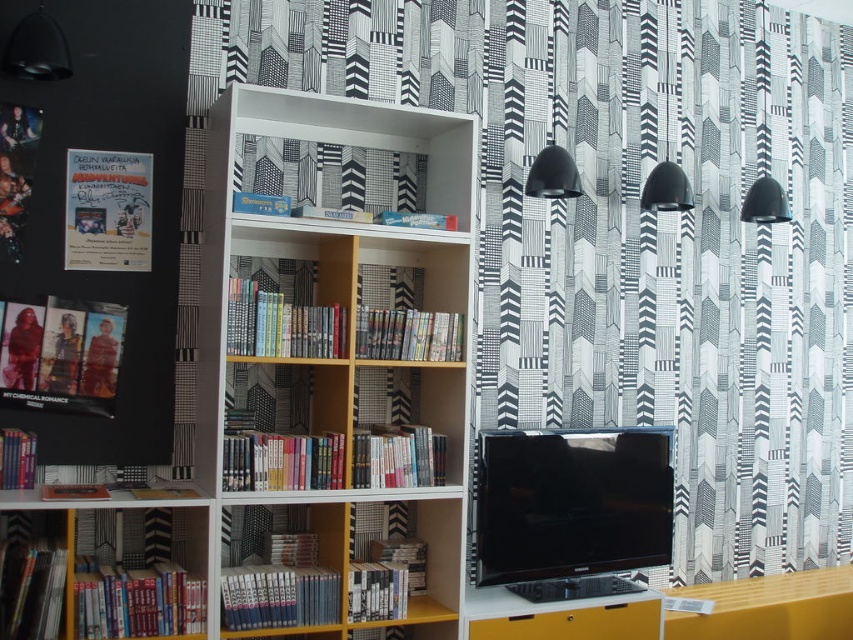
Question: Where is black and white patterned curtain at upper center located in relation to white wood bookshelf at center in the image?

Choices:
 (A) left
 (B) right

Answer: (B)

Question: Does black and white patterned curtain at upper center come in front of white wood bookshelf at center?

Choices:
 (A) no
 (B) yes

Answer: (A)

Question: Which point is closer to the camera?

Choices:
 (A) (431, 244)
 (B) (701, 160)

Answer: (A)

Question: Which object appears closest to the camera in this image?

Choices:
 (A) white wood bookshelf at center
 (B) black and white patterned curtain at upper center

Answer: (A)

Question: Can you confirm if black and white patterned curtain at upper center is positioned below white wood bookshelf at center?

Choices:
 (A) yes
 (B) no

Answer: (B)